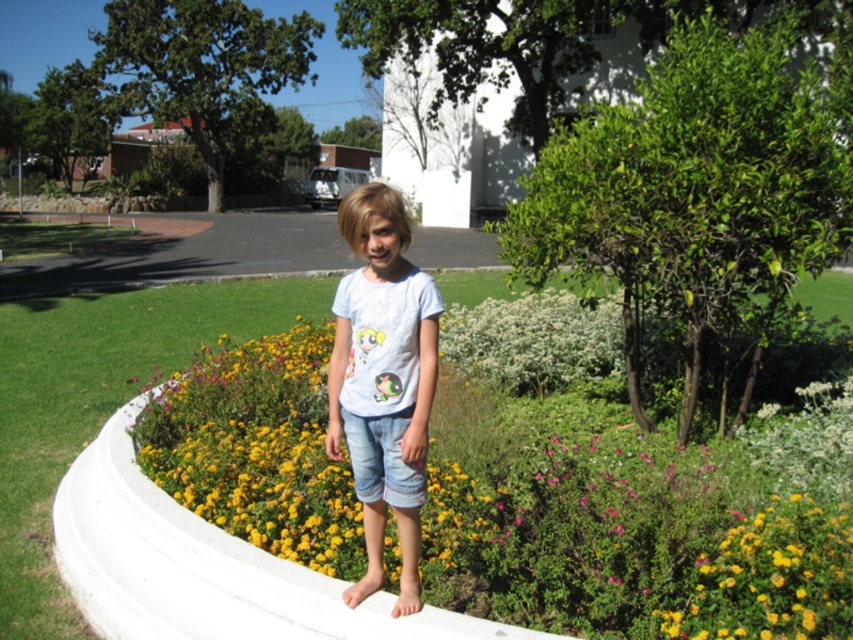
Question: Estimate the real-world distances between objects in this image. Which object is farther from the denim shorts at center?

Choices:
 (A) white cotton t-shirt at center
 (B) yellow matte flower at center
 (C) yellow matte flowers at center

Answer: (B)

Question: Is yellow matte flowers at center above white cotton t-shirt at center?

Choices:
 (A) yes
 (B) no

Answer: (B)

Question: Which object is closer to the camera taking this photo?

Choices:
 (A) white cotton t-shirt at center
 (B) yellow matte flower at center

Answer: (B)

Question: Is yellow matte flowers at center positioned before denim shorts at center?

Choices:
 (A) no
 (B) yes

Answer: (A)

Question: Does white cotton t-shirt at center have a lesser width compared to denim shorts at center?

Choices:
 (A) yes
 (B) no

Answer: (B)

Question: Which point is farther to the camera?

Choices:
 (A) denim shorts at center
 (B) yellow matte flowers at center

Answer: (B)